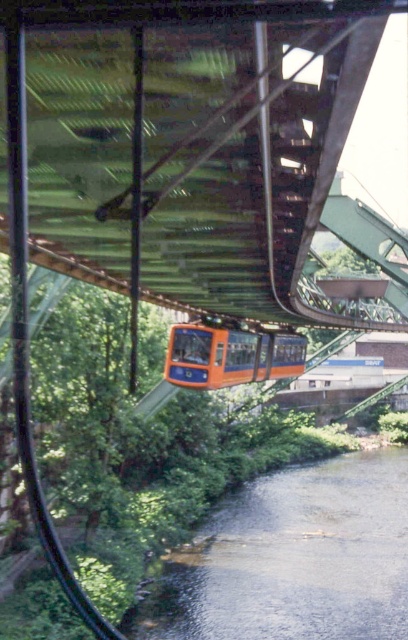
Question: Is clear water at lower center to the left of orange matte train at center from the viewer's perspective?

Choices:
 (A) no
 (B) yes

Answer: (A)

Question: From the image, what is the correct spatial relationship of clear water at lower center in relation to orange matte train at center?

Choices:
 (A) left
 (B) right

Answer: (B)

Question: Among these objects, which one is farthest from the camera?

Choices:
 (A) clear water at lower center
 (B) orange matte train at center

Answer: (B)

Question: Which of the following is the closest to the observer?

Choices:
 (A) (228, 336)
 (B) (244, 508)

Answer: (A)

Question: Can you confirm if clear water at lower center is smaller than orange matte train at center?

Choices:
 (A) yes
 (B) no

Answer: (B)